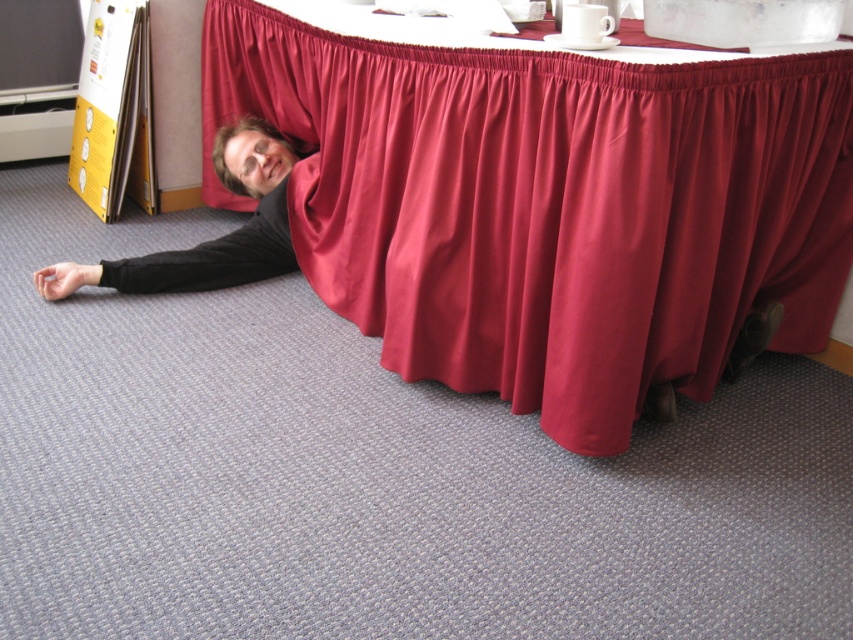
Question: Which object is farther from the camera taking this photo?

Choices:
 (A) burgundy satin curtain at lower center
 (B) black matte shirt at lower left

Answer: (B)

Question: Can you confirm if burgundy satin curtain at lower center is wider than black matte shirt at lower left?

Choices:
 (A) no
 (B) yes

Answer: (B)

Question: Is burgundy satin curtain at lower center to the left of black matte shirt at lower left from the viewer's perspective?

Choices:
 (A) no
 (B) yes

Answer: (A)

Question: Which point appears closest to the camera in this image?

Choices:
 (A) (715, 170)
 (B) (231, 150)

Answer: (A)

Question: Is burgundy satin curtain at lower center below black matte shirt at lower left?

Choices:
 (A) yes
 (B) no

Answer: (B)